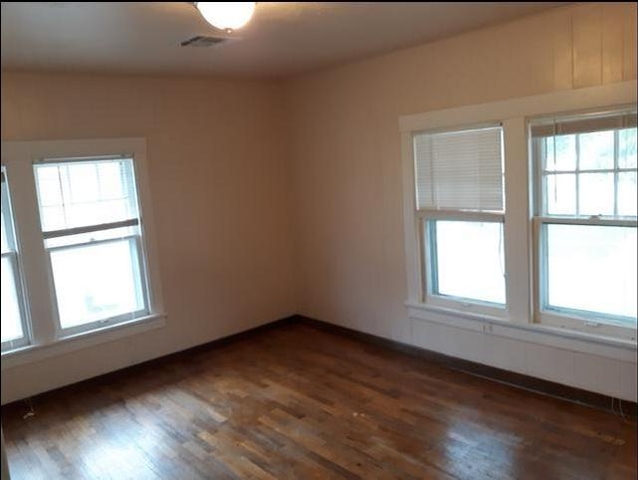
The image size is (638, 480). In order to click on ceiling in this screenshot , I will do `click(314, 50)`.